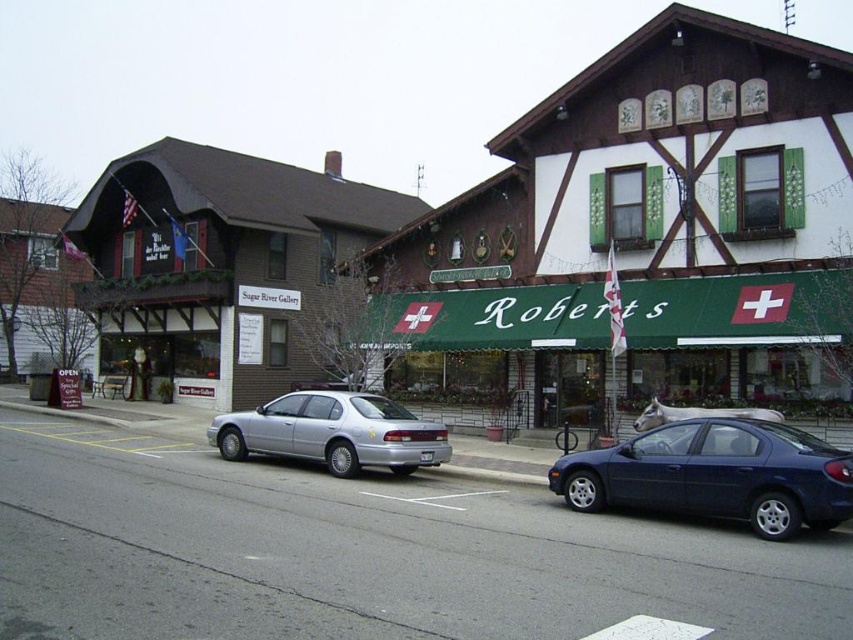
Question: Among these points, which one is nearest to the camera?

Choices:
 (A) (219, 310)
 (B) (793, 316)
 (C) (225, 426)
 (D) (708, 493)

Answer: (D)

Question: Is brick sugar river gallery at left below glossy blue sedan at lower right?

Choices:
 (A) yes
 (B) no

Answer: (B)

Question: Which object appears closest to the camera in this image?

Choices:
 (A) green fabric awning at center
 (B) glossy blue sedan at lower right
 (C) brick sugar river gallery at left

Answer: (B)

Question: Does green fabric awning at center appear on the left side of silver metallic sedan at center?

Choices:
 (A) yes
 (B) no

Answer: (B)

Question: Is brick sugar river gallery at left positioned behind silver metallic sedan at center?

Choices:
 (A) no
 (B) yes

Answer: (B)

Question: Which object is farther from the camera taking this photo?

Choices:
 (A) silver metallic sedan at center
 (B) brick sugar river gallery at left
 (C) glossy blue sedan at lower right

Answer: (B)